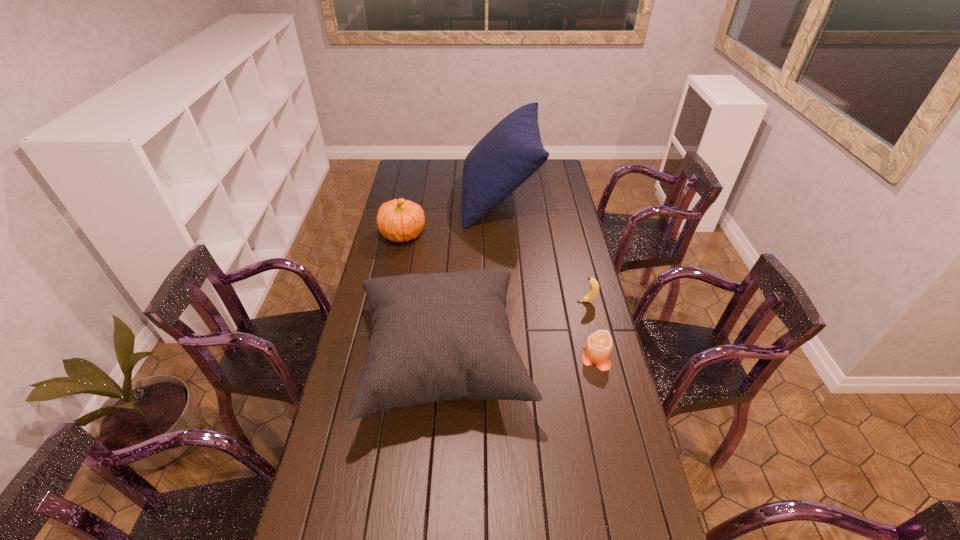
Where is `the tallest object`? Image resolution: width=960 pixels, height=540 pixels. the tallest object is located at coordinates (512, 151).

Identify the location of the farther cushion. (512, 151).

Locate an element on the screen. the fourth shortest object is located at coordinates (442, 336).

The image size is (960, 540). I want to click on the nearer cushion, so (x=442, y=336).

You are a GUI agent. You are given a task and a screenshot of the screen. Output one action in this format:
    pyautogui.click(x=<x>, y=<y>)
    Task: Click on the pumpkin
    
    Given the screenshot: What is the action you would take?
    pyautogui.click(x=400, y=220)

You are a GUI agent. You are given a task and a screenshot of the screen. Output one action in this format:
    pyautogui.click(x=<x>, y=<y>)
    Task: Click on the banana
    
    Given the screenshot: What is the action you would take?
    pyautogui.click(x=594, y=285)

Where is `candle`? The width and height of the screenshot is (960, 540). candle is located at coordinates (598, 347).

Where is `free space located 0.050m on the facing side of the taller cushion`? The image size is (960, 540). free space located 0.050m on the facing side of the taller cushion is located at coordinates (452, 198).

At what (x,y) coordinates should I click in order to perform the action: click on vacant area situated 0.320m on the facing side of the taller cushion. Please return your answer as a coordinate pair (x, y). The width and height of the screenshot is (960, 540). Looking at the image, I should click on (397, 198).

Locate an element on the screen. vacant region located 0.120m on the facing side of the taller cushion is located at coordinates (438, 198).